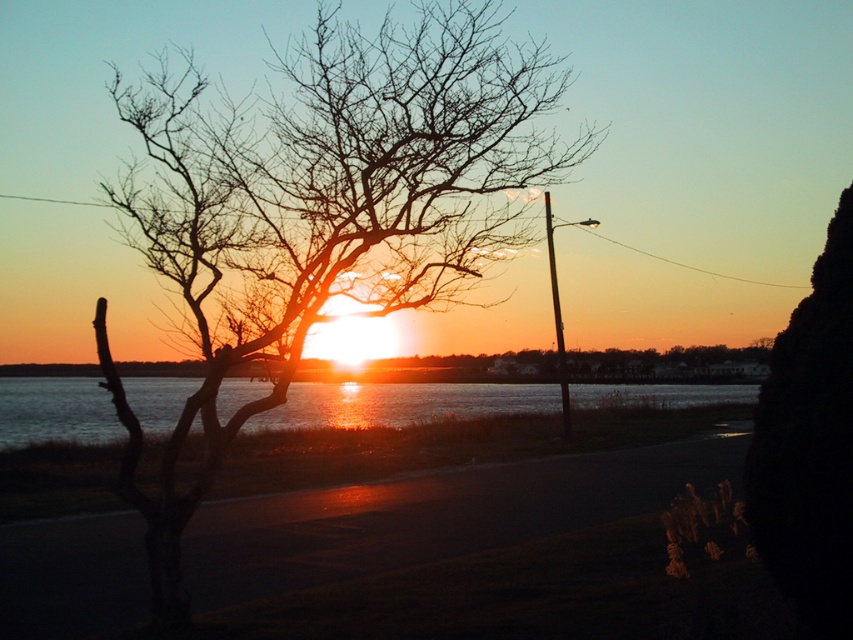
You are an artist trying to sketch this sunset scene. You want to place the bare branches at left accurately. According to the coordinates provided, where should you position them on your canvas?

The bare branches at left should be positioned at the coordinates point (323, 205) on the canvas.

You are standing at the point with coordinates point [372,49] and want to walk to the point with coordinates point [427,417]. Based on the scene description, will you have an unobstructed path? Explain your reasoning.

Point [372,49] is in front of point [427,417], so when moving from point [372,49] to point [427,417], the path may be obstructed by the silhouette of the bare tree in the foreground on the left side of the frame. Therefore, the path might not be completely unobstructed.

You are an ornithologist observing a bird that has landed on the bare branches at left. The bird is 5.30 meters away from the water. Can you confirm if the bird is closer to the water than the tree?

The bird is 5.30 meters away from the water, so yes, the bird is closer to the water than the tree.